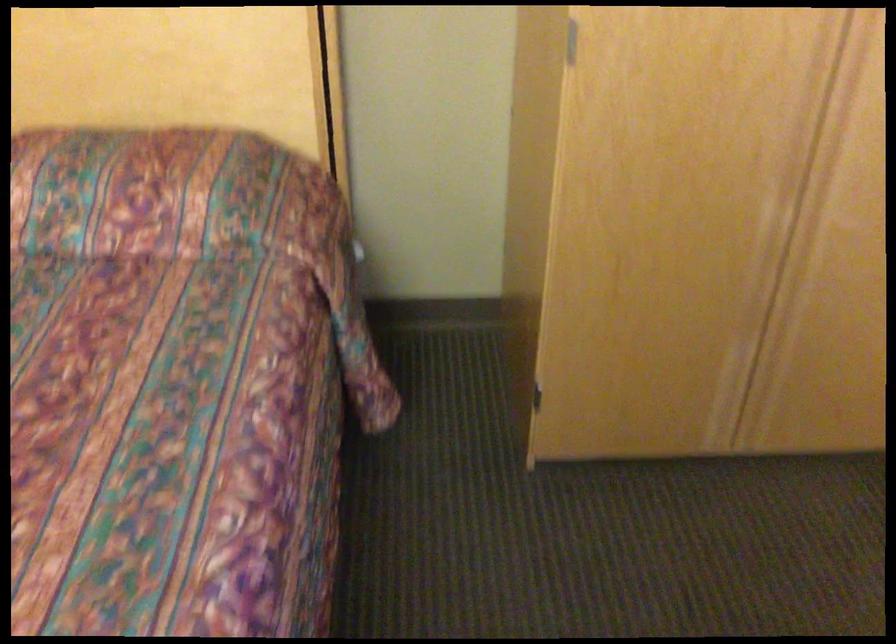
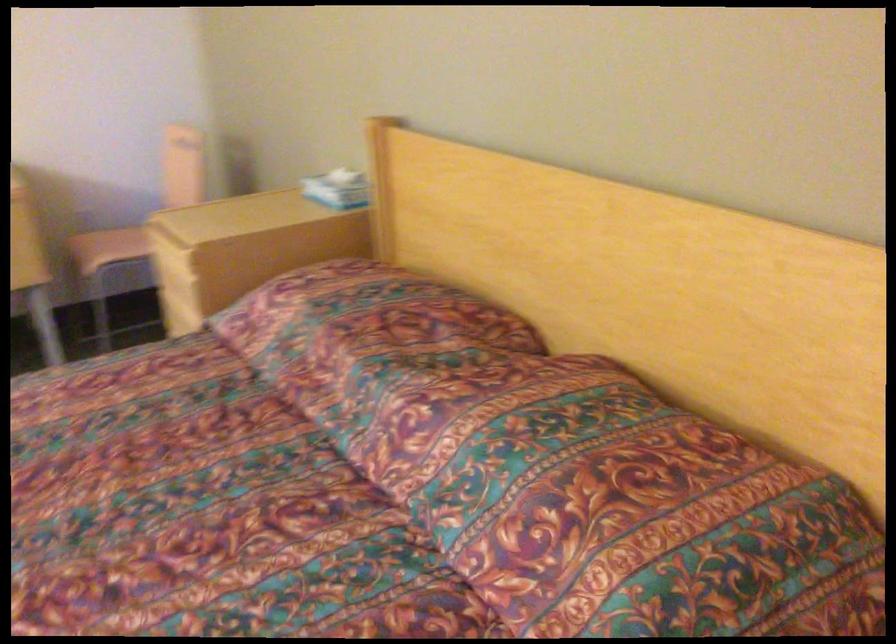
Question: The images are taken continuously from a first-person perspective. In which direction is your viewpoint rotating?

Choices:
 (A) Left
 (B) Right
 (C) Up
 (D) Down

Answer: (A)